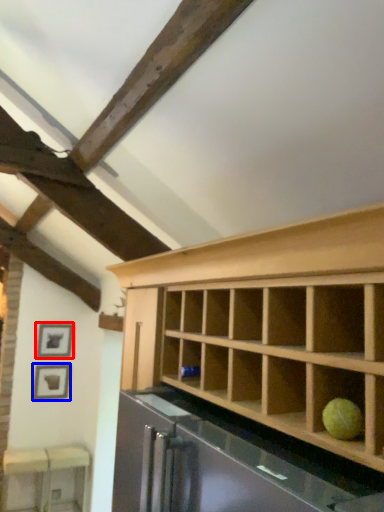
Question: Which object appears closest to the camera in this image, picture frame (highlighted by a red box) or picture frame (highlighted by a blue box)?

Choices:
 (A) picture frame
 (B) picture frame

Answer: (B)